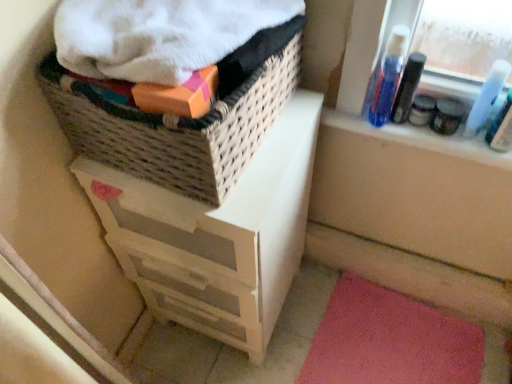
I want to click on vacant space underneath pink carpet at lower right (from a real-world perspective), so click(381, 340).